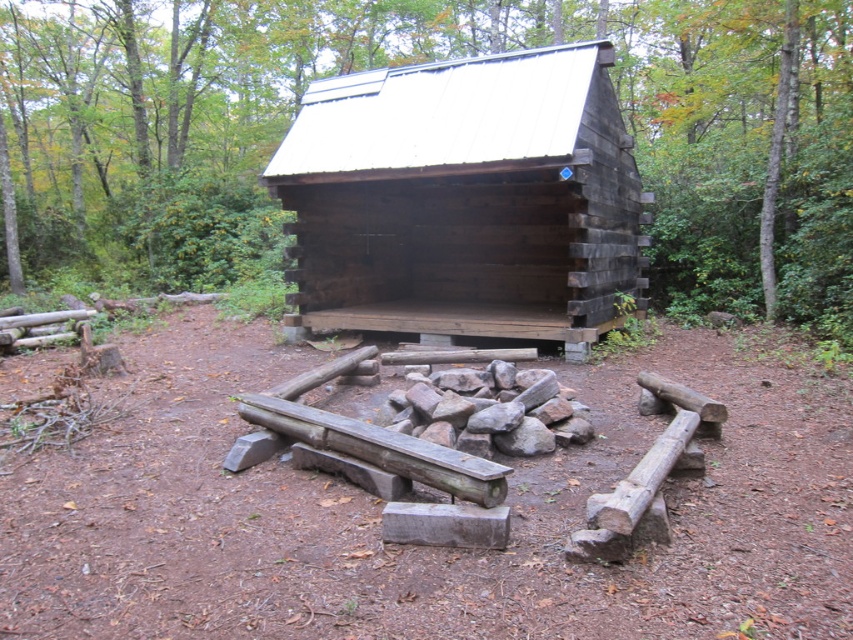
Question: Which point appears farthest from the camera in this image?

Choices:
 (A) (367, 88)
 (B) (677, 300)

Answer: (B)

Question: Is dark brown wood log cabin at center smaller than green leafy tree at upper right?

Choices:
 (A) yes
 (B) no

Answer: (A)

Question: Does brown wooden shelter at center appear under dark brown wood log cabin at center?

Choices:
 (A) no
 (B) yes

Answer: (A)

Question: Can you confirm if dark brown wood log cabin at center is positioned to the left of green leafy tree at upper right?

Choices:
 (A) yes
 (B) no

Answer: (A)

Question: Estimate the real-world distances between objects in this image. Which object is closer to the dark brown wood log cabin at center?

Choices:
 (A) brown wooden shelter at center
 (B) green leafy tree at upper right

Answer: (A)

Question: Which point is farther to the camera?

Choices:
 (A) (822, 218)
 (B) (119, 147)

Answer: (B)